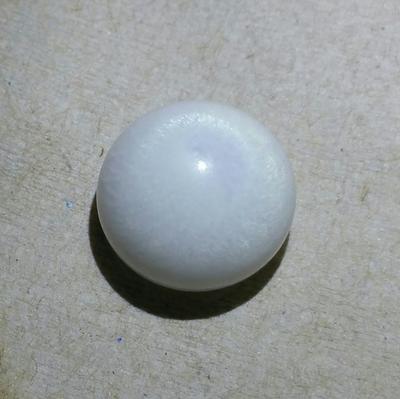
Where is `light`? The image size is (400, 399). light is located at coordinates (200, 165).